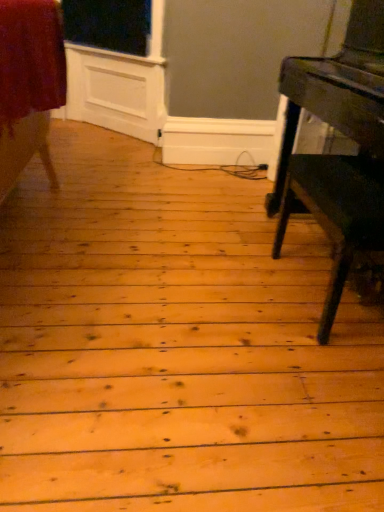
Question: Does shiny dark wood table at right lie behind velvet red skirt at left?

Choices:
 (A) yes
 (B) no

Answer: (B)

Question: From the image's perspective, would you say shiny dark wood table at right is shown under velvet red skirt at left?

Choices:
 (A) yes
 (B) no

Answer: (A)

Question: Is shiny dark wood table at right positioned beyond the bounds of velvet red skirt at left?

Choices:
 (A) no
 (B) yes

Answer: (B)

Question: From a real-world perspective, is shiny dark wood table at right below velvet red skirt at left?

Choices:
 (A) yes
 (B) no

Answer: (B)

Question: Is shiny dark wood table at right aimed at velvet red skirt at left?

Choices:
 (A) no
 (B) yes

Answer: (B)

Question: Is shiny dark wood table at right with velvet red skirt at left?

Choices:
 (A) no
 (B) yes

Answer: (A)

Question: Can you confirm if velvet red skirt at left is smaller than shiny dark wood table at right?

Choices:
 (A) yes
 (B) no

Answer: (A)

Question: Is velvet red skirt at left to the right of shiny dark wood table at right from the viewer's perspective?

Choices:
 (A) no
 (B) yes

Answer: (A)

Question: Is shiny dark wood table at right surrounded by velvet red skirt at left?

Choices:
 (A) yes
 (B) no

Answer: (B)

Question: From a real-world perspective, is velvet red skirt at left under shiny dark wood table at right?

Choices:
 (A) yes
 (B) no

Answer: (A)

Question: Is velvet red skirt at left not inside shiny dark wood table at right?

Choices:
 (A) yes
 (B) no

Answer: (A)

Question: From a real-world perspective, is velvet red skirt at left positioned over shiny dark wood table at right based on gravity?

Choices:
 (A) no
 (B) yes

Answer: (A)

Question: In the image, is shiny dark wood table at right on the left side or the right side of velvet red skirt at left?

Choices:
 (A) left
 (B) right

Answer: (B)